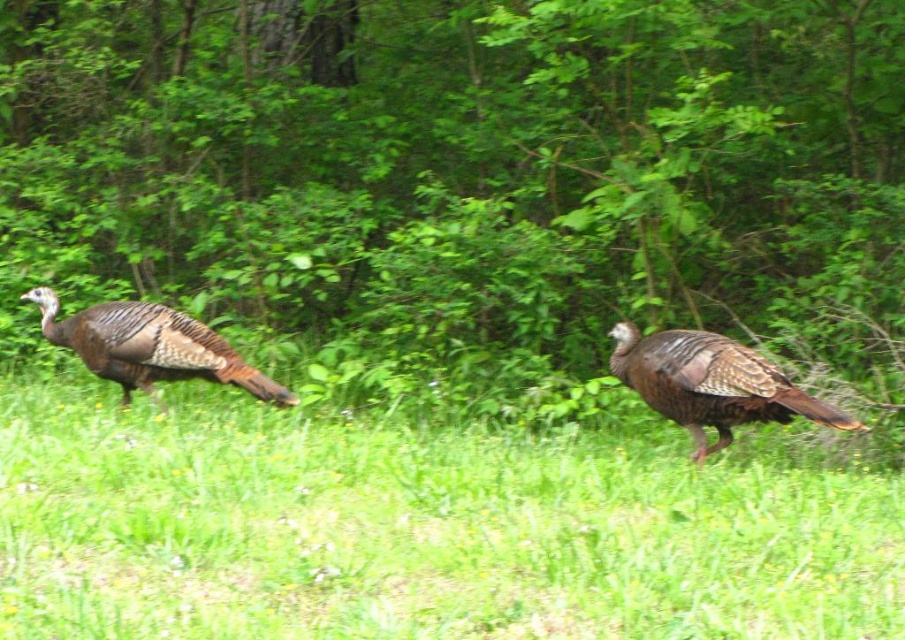
Which is more to the left, green grass at center or brown feathered turkey at left?

brown feathered turkey at left

Looking at this image, who is more forward, (39, 484) or (44, 332)?

Point (39, 484) is in front.

Locate an element on the screen. green grass at center is located at coordinates (417, 531).

Is green leafy tree at center above green grass at center?

Yes.

Find the location of a particular element. The image size is (905, 640). green leafy tree at center is located at coordinates (464, 177).

Is brown textured turkey at right above brown feathered turkey at left?

Actually, brown textured turkey at right is below brown feathered turkey at left.

Does brown textured turkey at right have a smaller size compared to brown feathered turkey at left?

No.

Between point (673, 333) and point (97, 355), which one is positioned behind?

The point (97, 355) is behind.

The image size is (905, 640). I want to click on brown textured turkey at right, so click(x=711, y=384).